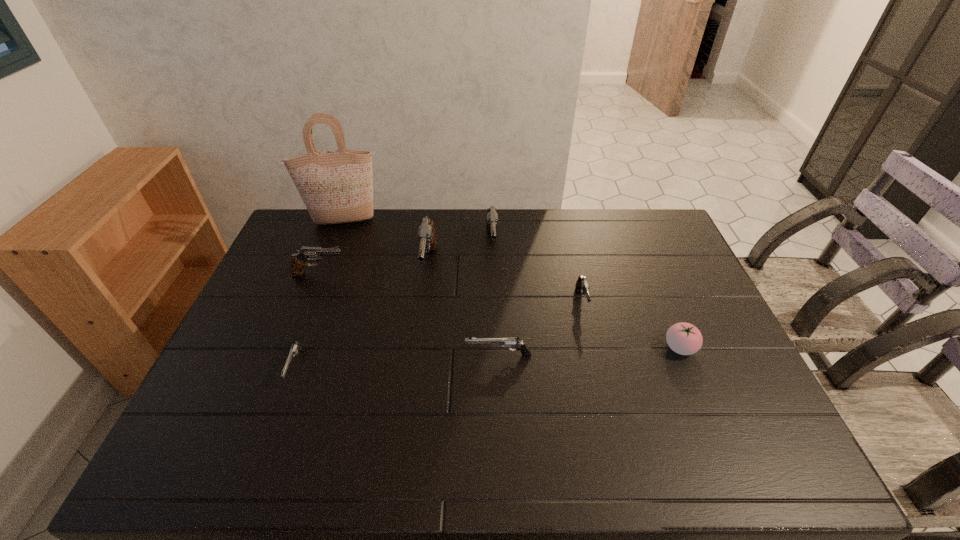
Select which gray pistol is the second closest to the rightmost gray pistol. Please provide its 2D coordinates. Your answer should be formatted as a tuple, i.e. [(x, y)], where the tuple contains the x and y coordinates of a point satisfying the conditions above.

[(426, 236)]

Locate an element on the screen. Image resolution: width=960 pixels, height=540 pixels. free space that satisfies the following two spatial constraints: 1. on the back side of the tomato; 2. at the barrel of the leftmost gray pistol is located at coordinates tap(650, 274).

Where is `free spot that satisfies the following two spatial constraints: 1. at the barrel of the fourth shortest pistol; 2. on the right side of the tomato`? This screenshot has width=960, height=540. free spot that satisfies the following two spatial constraints: 1. at the barrel of the fourth shortest pistol; 2. on the right side of the tomato is located at coordinates pos(290,348).

This screenshot has height=540, width=960. Find the location of `vacant point that satisfies the following two spatial constraints: 1. at the barrel of the fourth shortest pistol; 2. on the left side of the red tomato`. vacant point that satisfies the following two spatial constraints: 1. at the barrel of the fourth shortest pistol; 2. on the left side of the red tomato is located at coordinates (290, 348).